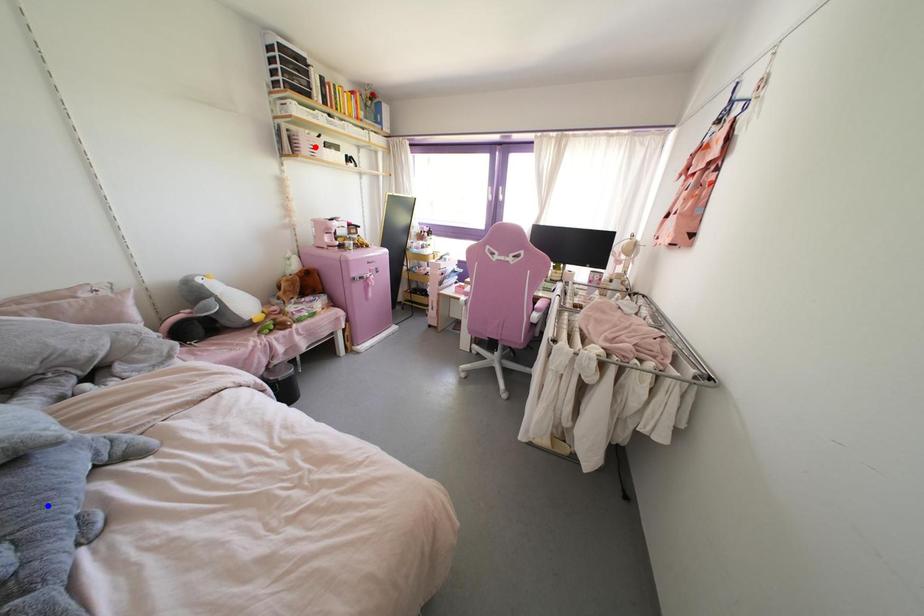
Question: Two points are marked on the image. Which point is closer to the camera?

Choices:
 (A) Blue point is closer.
 (B) Red point is closer.

Answer: (A)